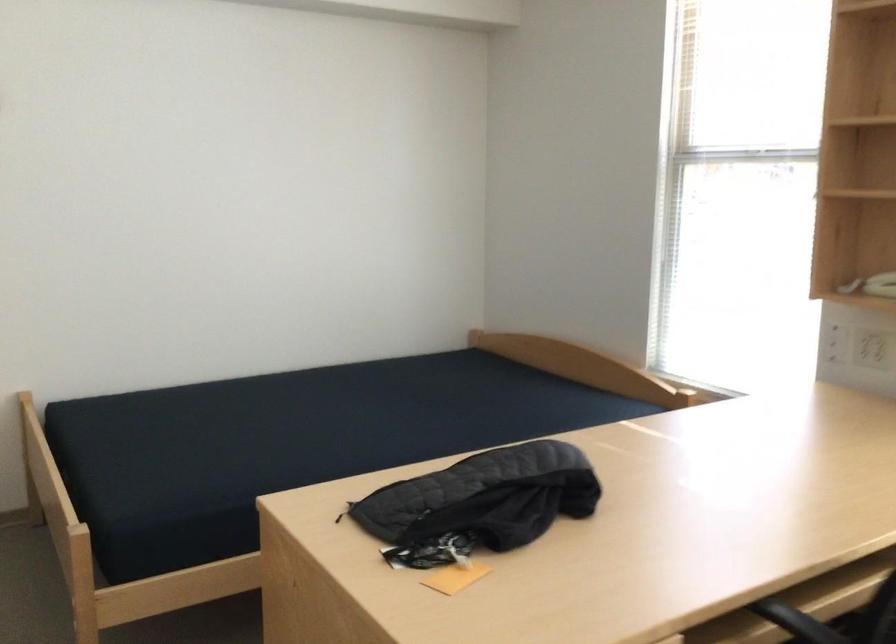
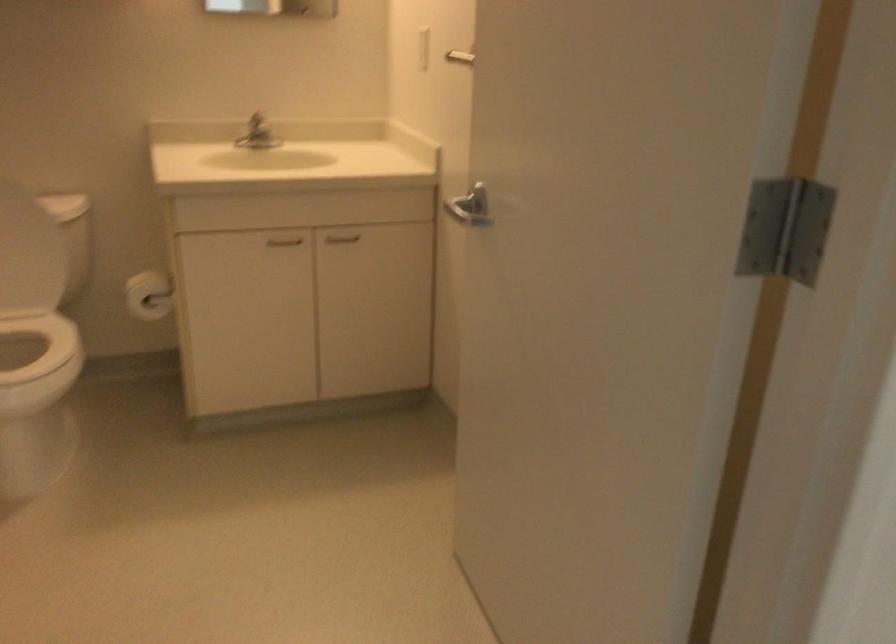
Question: What movement of the cameraman would produce the second image?

Choices:
 (A) Left
 (B) Right
 (C) Forward
 (D) Backward

Answer: (A)